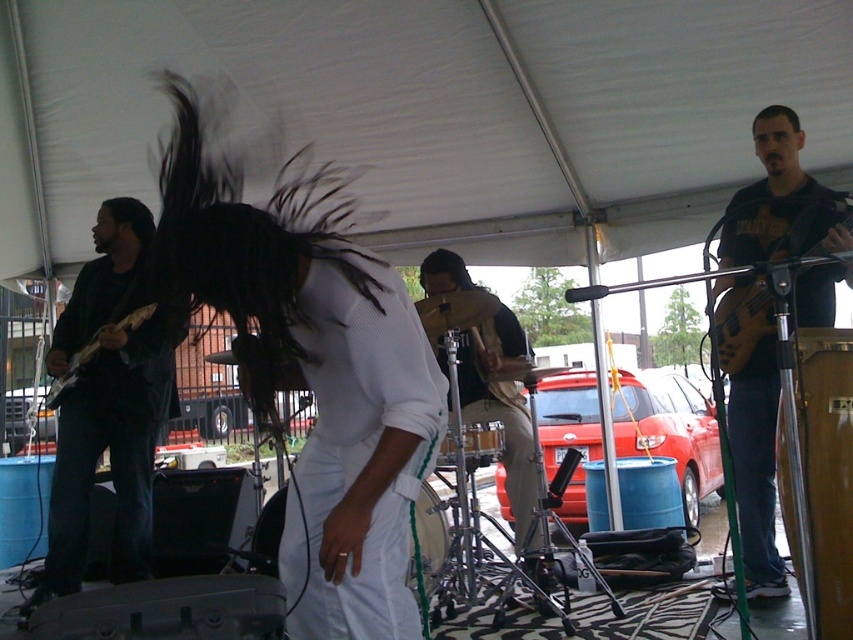
Between leather drum set at center and black matte hair at upper right, which one has less height?

With less height is black matte hair at upper right.

Does leather drum set at center have a larger size compared to black matte hair at upper right?

Result: Yes.

Is point (525, 358) in front of point (764, 116)?

No.

The width and height of the screenshot is (853, 640). I want to click on leather drum set at center, so click(x=502, y=410).

In the scene shown: Does matte black guitar at left appear over matte brown electric guitar at right?

Actually, matte black guitar at left is below matte brown electric guitar at right.

Who is higher up, matte black guitar at left or matte brown electric guitar at right?

matte brown electric guitar at right is above.

Between point (132, 522) and point (840, 248), which one is positioned in front?

Point (840, 248) is more forward.

Find the location of a particular element. matte black guitar at left is located at coordinates (109, 400).

Is point (132, 250) positioned before point (70, 372)?

No, (132, 250) is behind (70, 372).

Where is `matte black guitar at left`? The height and width of the screenshot is (640, 853). matte black guitar at left is located at coordinates (109, 400).